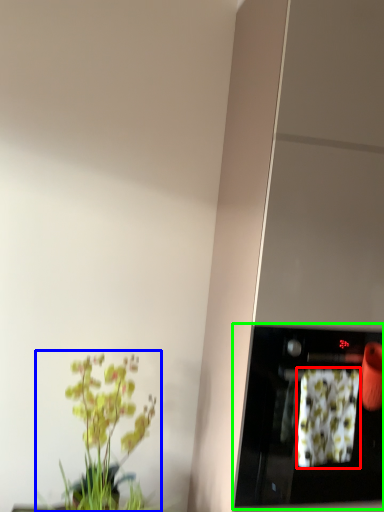
Question: Which object is positioned farthest from flower (highlighted by a red box)? Select from houseplant (highlighted by a blue box) and appliance (highlighted by a green box).

Choices:
 (A) houseplant
 (B) appliance

Answer: (A)